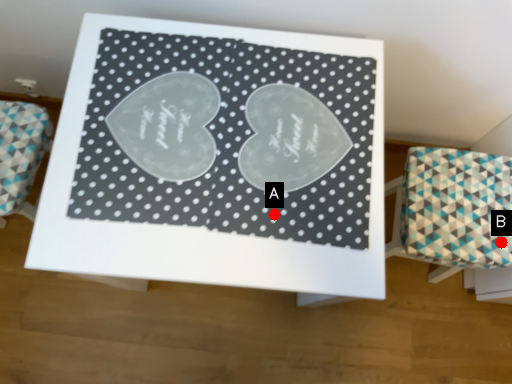
Question: Two points are circled on the image, labeled by A and B beside each circle. Which of the following is the farthest from the observer?

Choices:
 (A) A is further
 (B) B is further

Answer: (B)